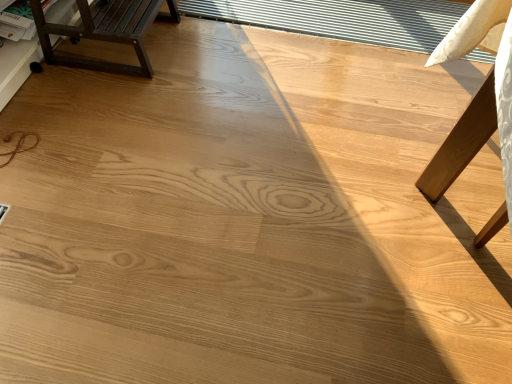
Where is `transparent plastic window at upper center`? The width and height of the screenshot is (512, 384). transparent plastic window at upper center is located at coordinates (342, 19).

This screenshot has height=384, width=512. What do you see at coordinates (342, 19) in the screenshot?
I see `transparent plastic window at upper center` at bounding box center [342, 19].

The width and height of the screenshot is (512, 384). What do you see at coordinates (106, 31) in the screenshot?
I see `matte dark brown wooden bench at upper left` at bounding box center [106, 31].

In order to face matte dark brown wooden bench at upper left, should I rotate leftwards or rightwards?

Turn left by 18.886 degrees to look at matte dark brown wooden bench at upper left.

Measure the distance between point (x=114, y=14) and camera.

Point (x=114, y=14) is 1.62 meters away from camera.

Locate an element on the screen. This screenshot has height=384, width=512. matte dark brown wooden bench at upper left is located at coordinates (106, 31).

At what (x,y) coordinates should I click in order to perform the action: click on transparent plastic window at upper center. Please return your answer as a coordinate pair (x, y). This screenshot has height=384, width=512. Looking at the image, I should click on (342, 19).

Can you confirm if matte dark brown wooden bench at upper left is positioned to the right of transparent plastic window at upper center?

Incorrect, matte dark brown wooden bench at upper left is not on the right side of transparent plastic window at upper center.

Considering their positions, is matte dark brown wooden bench at upper left located in front of or behind transparent plastic window at upper center?

matte dark brown wooden bench at upper left is positioned closer to the viewer than transparent plastic window at upper center.

Considering the positions of points (116, 2) and (421, 35), is point (116, 2) closer to camera compared to point (421, 35)?

Yes.

From the image's perspective, is matte dark brown wooden bench at upper left above or below transparent plastic window at upper center?

matte dark brown wooden bench at upper left is situated lower than transparent plastic window at upper center in the image.

From a real-world perspective, between matte dark brown wooden bench at upper left and transparent plastic window at upper center, who is vertically higher?

matte dark brown wooden bench at upper left, from a real-world perspective.

Does matte dark brown wooden bench at upper left have a greater width compared to transparent plastic window at upper center?

No.

Which of these two, matte dark brown wooden bench at upper left or transparent plastic window at upper center, stands shorter?

With less height is transparent plastic window at upper center.

Who is smaller, matte dark brown wooden bench at upper left or transparent plastic window at upper center?

transparent plastic window at upper center is smaller.

Is matte dark brown wooden bench at upper left completely or partially outside of transparent plastic window at upper center?

That's correct, matte dark brown wooden bench at upper left is outside of transparent plastic window at upper center.

Is matte dark brown wooden bench at upper left placed right next to transparent plastic window at upper center?

There is a gap between matte dark brown wooden bench at upper left and transparent plastic window at upper center.

Could you tell me if matte dark brown wooden bench at upper left is turned towards transparent plastic window at upper center?

Yes, matte dark brown wooden bench at upper left is aimed at transparent plastic window at upper center.

You are a GUI agent. You are given a task and a screenshot of the screen. Output one action in this format:
    pyautogui.click(x=<x>, y=<y>)
    Task: Click on the window on the right of matte dark brown wooden bench at upper left
    This screenshot has width=512, height=384.
    Given the screenshot: What is the action you would take?
    pyautogui.click(x=342, y=19)

Is transparent plastic window at upper center at the right side of matte dark brown wooden bench at upper left?

Correct, you'll find transparent plastic window at upper center to the right of matte dark brown wooden bench at upper left.

Is transparent plastic window at upper center behind matte dark brown wooden bench at upper left?

Yes, transparent plastic window at upper center is further from the viewer.

Considering the points (428, 43) and (114, 19), which point is behind, point (428, 43) or point (114, 19)?

The point (428, 43) is more distant.

From the image's perspective, is transparent plastic window at upper center above matte dark brown wooden bench at upper left?

Correct, transparent plastic window at upper center appears higher than matte dark brown wooden bench at upper left in the image.

From a real-world perspective, is transparent plastic window at upper center on matte dark brown wooden bench at upper left?

No, from a real-world perspective, transparent plastic window at upper center is not on top of matte dark brown wooden bench at upper left.

Considering the sizes of objects transparent plastic window at upper center and matte dark brown wooden bench at upper left in the image provided, who is wider, transparent plastic window at upper center or matte dark brown wooden bench at upper left?

With larger width is transparent plastic window at upper center.

Does transparent plastic window at upper center have a lesser height compared to matte dark brown wooden bench at upper left?

Answer: Yes, transparent plastic window at upper center is shorter than matte dark brown wooden bench at upper left.

Considering the sizes of objects transparent plastic window at upper center and matte dark brown wooden bench at upper left in the image provided, who is bigger, transparent plastic window at upper center or matte dark brown wooden bench at upper left?

With larger size is matte dark brown wooden bench at upper left.

Which is correct: transparent plastic window at upper center is inside matte dark brown wooden bench at upper left, or outside of it?

transparent plastic window at upper center lies outside matte dark brown wooden bench at upper left.

Is transparent plastic window at upper center far from matte dark brown wooden bench at upper left?

No.

Could you tell me if transparent plastic window at upper center is turned towards matte dark brown wooden bench at upper left?

No, transparent plastic window at upper center is not aimed at matte dark brown wooden bench at upper left.

Can you tell me how much transparent plastic window at upper center and matte dark brown wooden bench at upper left differ in facing direction?

There is a 90.7-degree angle between the facing directions of transparent plastic window at upper center and matte dark brown wooden bench at upper left.

Where is `furniture below the transparent plastic window at upper center (from the image's perspective)`? furniture below the transparent plastic window at upper center (from the image's perspective) is located at coordinates (106, 31).

In order to click on furniture that appears on the left of transparent plastic window at upper center in this screenshot , I will do `click(106, 31)`.

The height and width of the screenshot is (384, 512). What are the coordinates of `furniture below the transparent plastic window at upper center (from the image's perspective)` in the screenshot? It's located at (106, 31).